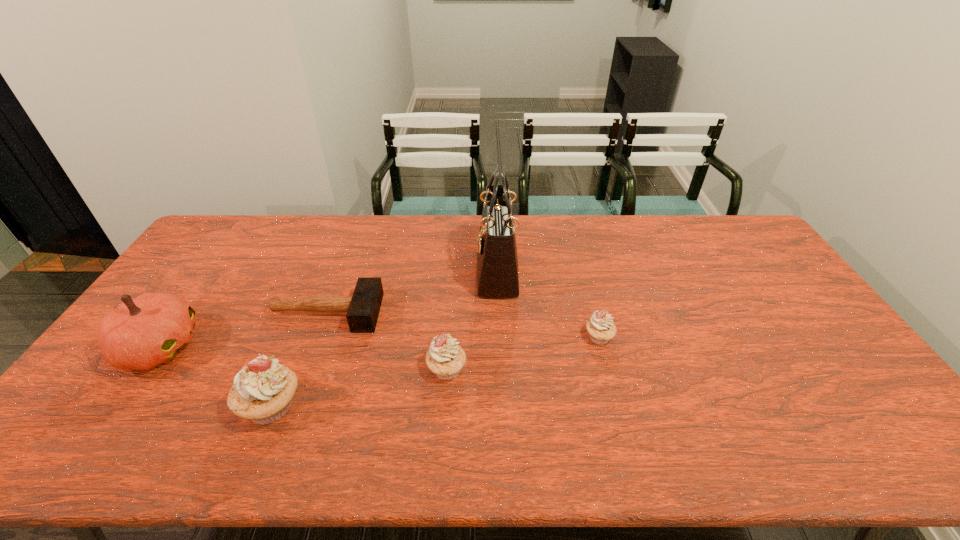
At what (x,y) coordinates should I click in order to perform the action: click on vacant region between the shortest object and the handbag. Please return your answer as a coordinate pair (x, y). The image size is (960, 540). Looking at the image, I should click on (412, 292).

Identify the location of free space between the leftmost cupcake and the pumpkin. The image size is (960, 540). (215, 376).

In order to click on free spot between the leftmost cupcake and the handbag in this screenshot , I will do `click(384, 339)`.

You are a GUI agent. You are given a task and a screenshot of the screen. Output one action in this format:
    pyautogui.click(x=<x>, y=<y>)
    Task: Click on the vacant area that lies between the tallest cupcake and the tallest object
    
    Given the screenshot: What is the action you would take?
    pyautogui.click(x=384, y=339)

Identify which object is located as the third nearest to the fourth tallest object. Please provide its 2D coordinates. Your answer should be formatted as a tuple, i.e. [(x, y)], where the tuple contains the x and y coordinates of a point satisfying the conditions above.

[(263, 390)]

Identify which object is located as the nearest to the mallet. Please provide its 2D coordinates. Your answer should be formatted as a tuple, i.e. [(x, y)], where the tuple contains the x and y coordinates of a point satisfying the conditions above.

[(143, 332)]

Locate which cupcake ranks second in proximity to the shortest object. Please provide its 2D coordinates. Your answer should be formatted as a tuple, i.e. [(x, y)], where the tuple contains the x and y coordinates of a point satisfying the conditions above.

[(445, 358)]

Point out which cupcake is positioned as the nearest to the tallest object. Please provide its 2D coordinates. Your answer should be formatted as a tuple, i.e. [(x, y)], where the tuple contains the x and y coordinates of a point satisfying the conditions above.

[(600, 327)]

In order to click on vacant area in the image that satisfies the following two spatial constraints: 1. on the back side of the shortest cupcake; 2. on the hammer head face of the mallet in this screenshot , I will do `click(592, 313)`.

Find the location of `blank area in the image that satisfies the following two spatial constraints: 1. at the front of the shortest cupcake with visible charms; 2. on the right side of the second object from right to left`. blank area in the image that satisfies the following two spatial constraints: 1. at the front of the shortest cupcake with visible charms; 2. on the right side of the second object from right to left is located at coordinates (500, 337).